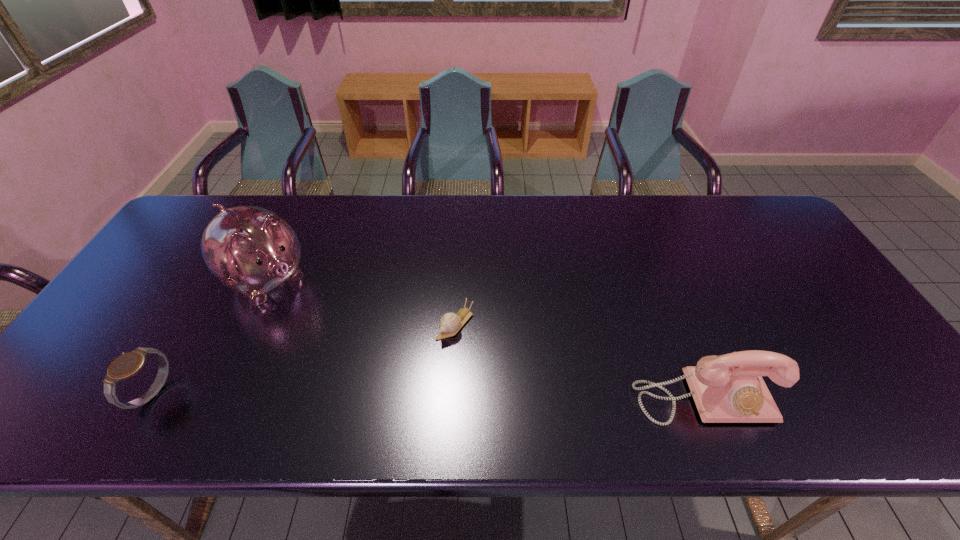
Locate an element on the screen. Image resolution: width=960 pixels, height=540 pixels. free space on the desktop that is between the watch and the telephone and is positioned on the shell of the third object from left to right is located at coordinates (394, 395).

Identify the location of free spot on the desktop that is between the watch and the rightmost object and is positioned on the front facing side of the piggy bank. (414, 395).